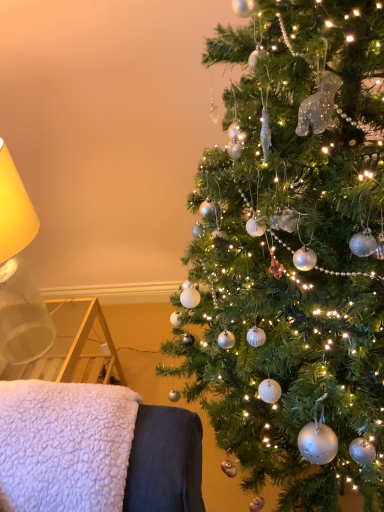
Question: Would you consider translucent glass lampshade at left to be distant from shiny silver ornaments at right?

Choices:
 (A) no
 (B) yes

Answer: (A)

Question: From the image's perspective, is translucent glass lampshade at left on shiny silver ornaments at right?

Choices:
 (A) no
 (B) yes

Answer: (B)

Question: Would you say translucent glass lampshade at left is outside shiny silver ornaments at right?

Choices:
 (A) no
 (B) yes

Answer: (B)

Question: From a real-world perspective, does translucent glass lampshade at left sit lower than shiny silver ornaments at right?

Choices:
 (A) yes
 (B) no

Answer: (B)

Question: Can you confirm if translucent glass lampshade at left is smaller than shiny silver ornaments at right?

Choices:
 (A) yes
 (B) no

Answer: (A)

Question: Based on their sizes in the image, would you say translucent glass lampshade at left is bigger or smaller than shiny silver ornaments at right?

Choices:
 (A) small
 (B) big

Answer: (A)

Question: Is translucent glass lampshade at left taller or shorter than shiny silver ornaments at right?

Choices:
 (A) short
 (B) tall

Answer: (A)

Question: Is point (3, 154) positioned closer to the camera than point (286, 129)?

Choices:
 (A) farther
 (B) closer

Answer: (A)

Question: In the image, is translucent glass lampshade at left on the left side or the right side of shiny silver ornaments at right?

Choices:
 (A) left
 (B) right

Answer: (A)

Question: In terms of width, does shiny silver ornaments at right look wider or thinner when compared to white fluffy blanket at lower left?

Choices:
 (A) wide
 (B) thin

Answer: (A)

Question: Based on their positions, is shiny silver ornaments at right located to the left or right of white fluffy blanket at lower left?

Choices:
 (A) right
 (B) left

Answer: (A)

Question: Is shiny silver ornaments at right inside the boundaries of white fluffy blanket at lower left, or outside?

Choices:
 (A) inside
 (B) outside

Answer: (B)

Question: In terms of height, does shiny silver ornaments at right look taller or shorter compared to white fluffy blanket at lower left?

Choices:
 (A) short
 (B) tall

Answer: (B)

Question: Choose the correct answer: Is translucent glass lampshade at left inside white fluffy blanket at lower left or outside it?

Choices:
 (A) outside
 (B) inside

Answer: (A)

Question: Is point (1, 187) closer or farther from the camera than point (92, 392)?

Choices:
 (A) closer
 (B) farther

Answer: (B)